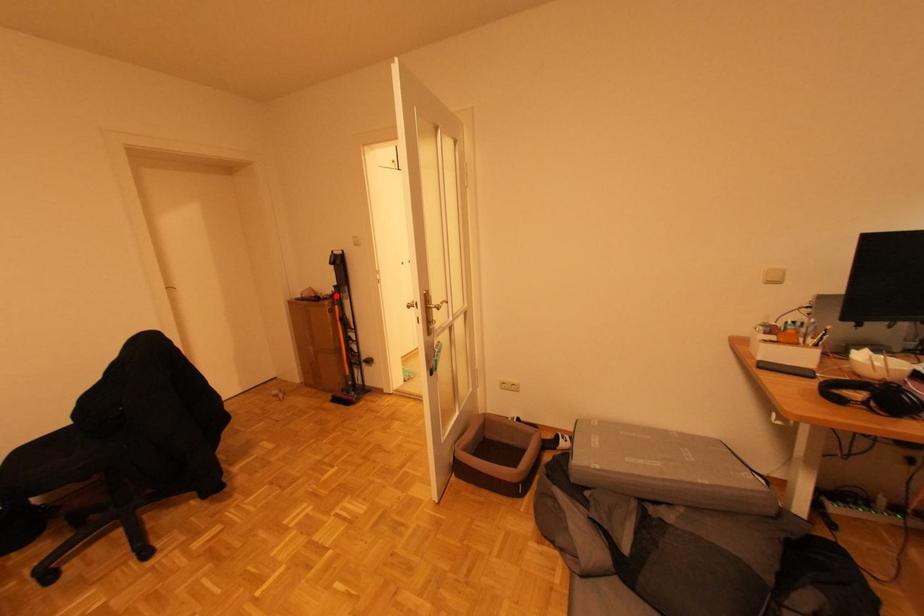
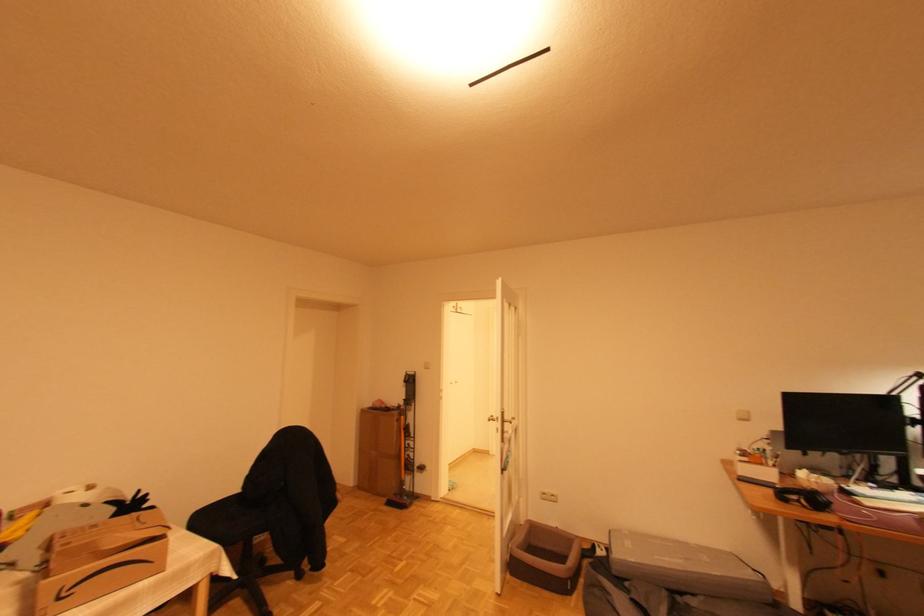
In the second image, find the point that corresponds to the highlighted location in the first image.

(402, 407)